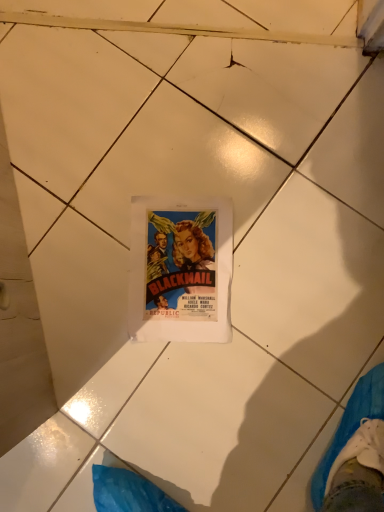
You are a GUI agent. You are given a task and a screenshot of the screen. Output one action in this format:
    pyautogui.click(x=<x>, y=<y>)
    Task: Click on the matte paper poster at center
    The image size is (384, 512).
    Given the screenshot: What is the action you would take?
    pyautogui.click(x=180, y=270)

Describe the element at coordinates (180, 270) in the screenshot. Image resolution: width=384 pixels, height=512 pixels. I see `matte paper poster at center` at that location.

Where is `matte paper poster at center`? The height and width of the screenshot is (512, 384). matte paper poster at center is located at coordinates (180, 270).